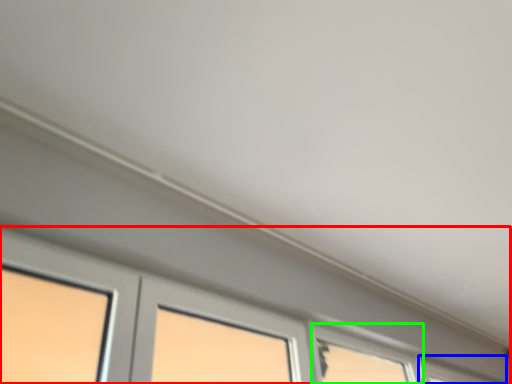
Question: Which object is positioned farthest from window (highlighted by a red box)? Select from window (highlighted by a blue box) and window (highlighted by a green box).

Choices:
 (A) window
 (B) window

Answer: (B)